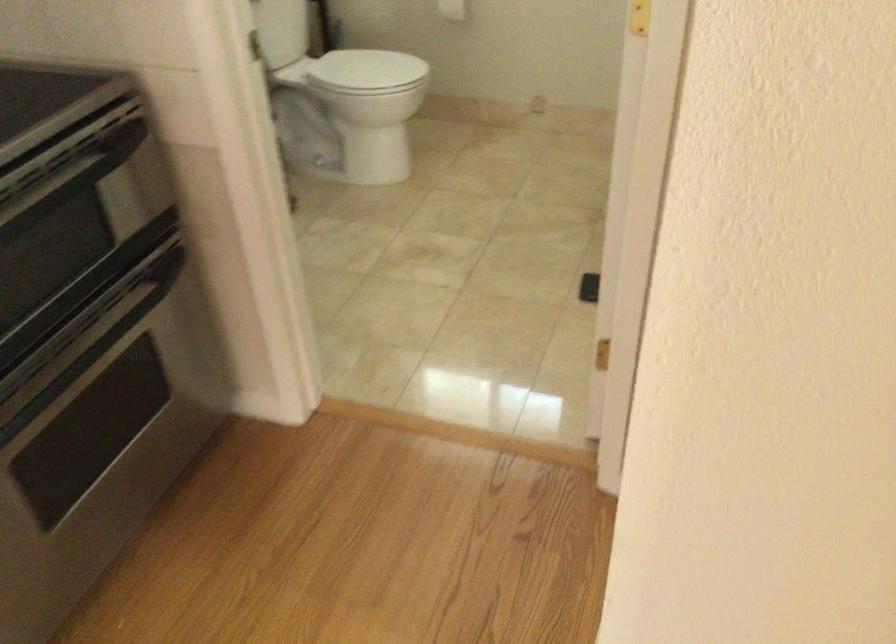
Based on the continuous images, in which direction is the camera rotating?

The camera rotated toward left-down.